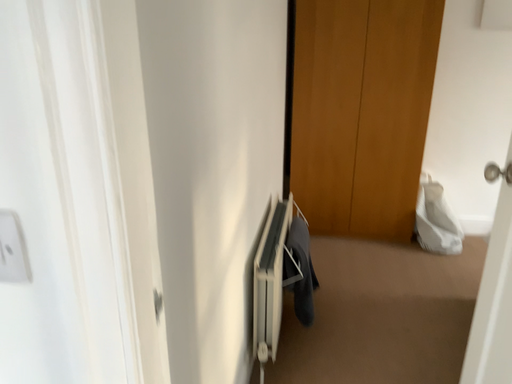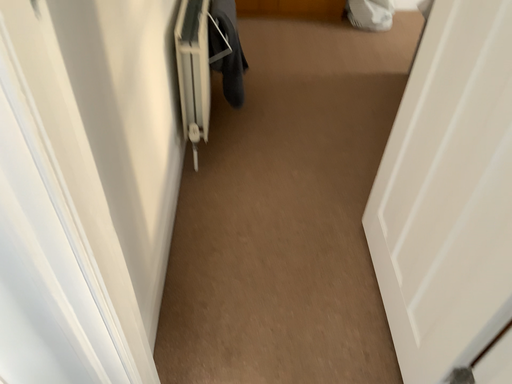
Question: Which way did the camera rotate in the video?

Choices:
 (A) rotated downward
 (B) rotated upward

Answer: (A)